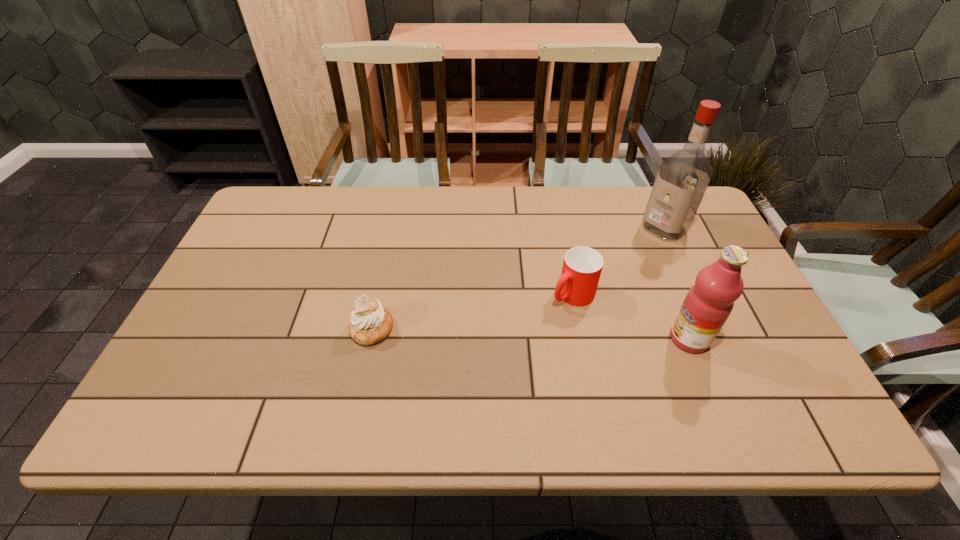
This screenshot has width=960, height=540. Find the location of `object that is at the far right corner`. object that is at the far right corner is located at coordinates (682, 179).

Where is `vacant region at the far edge of the desktop`? The image size is (960, 540). vacant region at the far edge of the desktop is located at coordinates click(x=605, y=191).

This screenshot has height=540, width=960. Find the location of `free space at the near edge of the desktop`. free space at the near edge of the desktop is located at coordinates (297, 385).

Find the location of a particular element. This screenshot has width=960, height=540. free space at the left edge is located at coordinates (274, 271).

The height and width of the screenshot is (540, 960). What are the coordinates of `vacant space at the right edge of the desktop` in the screenshot? It's located at (737, 332).

Locate an element on the screen. This screenshot has height=540, width=960. free space between the fruit juice and the cup is located at coordinates [631, 316].

Where is `blank region between the second object from left to right and the fruit juice`? The image size is (960, 540). blank region between the second object from left to right and the fruit juice is located at coordinates (631, 316).

The image size is (960, 540). I want to click on vacant space that is in between the second tallest object and the second shortest object, so click(x=631, y=316).

Identify the location of vacant space in between the leftmost object and the liquor. (517, 278).

The width and height of the screenshot is (960, 540). Find the location of `vacant point located between the cup and the pastry`. vacant point located between the cup and the pastry is located at coordinates (472, 311).